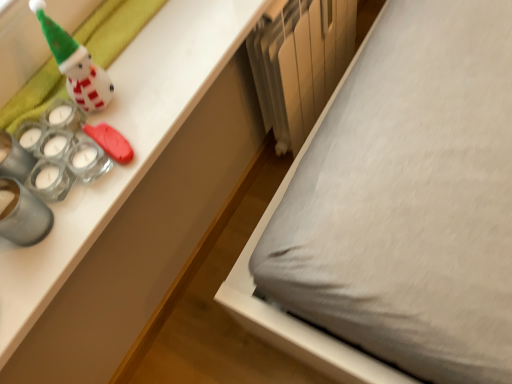
You are a GUI agent. You are given a task and a screenshot of the screen. Output one action in this format:
    pyautogui.click(x=<x>, y=<y>)
    Task: Click on the free spot above white glossy desk at upper left (from a real-world perspective)
    This screenshot has height=384, width=512.
    Given the screenshot: What is the action you would take?
    pyautogui.click(x=120, y=104)